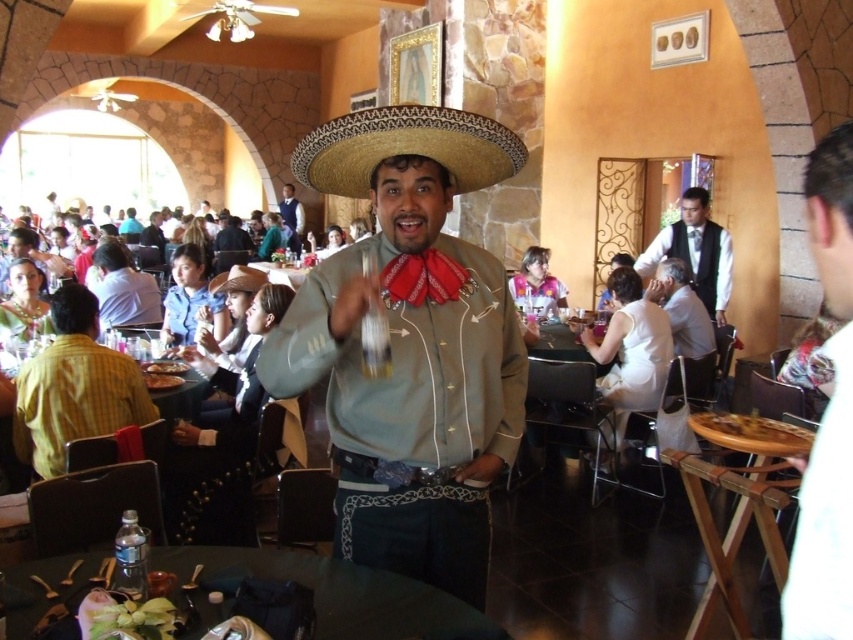
Consider the image. Does matte green shirt at center appear on the left side of light blue shirt at center?

Incorrect, matte green shirt at center is not on the left side of light blue shirt at center.

Can you confirm if matte green shirt at center is positioned below light blue shirt at center?

Yes.

Identify the location of matte green shirt at center. (409, 342).

Can you confirm if yellow checkered shirt at left is wider than smooth black suit at center?

Indeed, yellow checkered shirt at left has a greater width compared to smooth black suit at center.

The height and width of the screenshot is (640, 853). I want to click on yellow checkered shirt at left, so click(x=74, y=387).

Can you confirm if white shirt at right is shorter than brown felt cowboy hat at center?

No.

Find the location of a particular element. The height and width of the screenshot is (640, 853). white shirt at right is located at coordinates (827, 416).